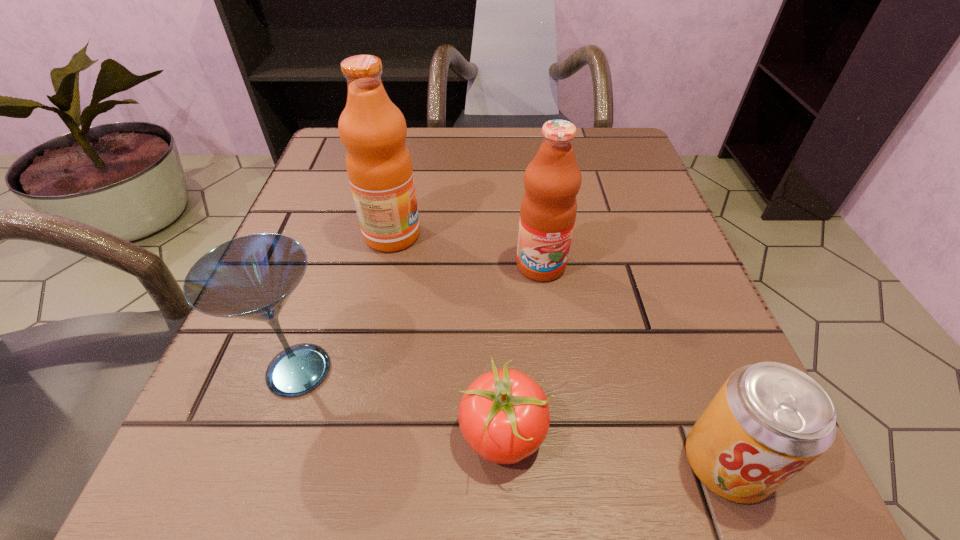
The height and width of the screenshot is (540, 960). What are the coordinates of `vacant area at the near edge` in the screenshot? It's located at (413, 489).

In the image, there is a desktop. At what (x,y) coordinates should I click in order to perform the action: click on vacant space at the left edge. Please return your answer as a coordinate pair (x, y). Looking at the image, I should click on (336, 249).

I want to click on free space at the right edge, so click(x=645, y=268).

Identify the location of vacant space at the far left corner. (336, 167).

I want to click on free space at the near left corner of the desktop, so click(x=316, y=438).

Find the location of `free space at the far right corner`. free space at the far right corner is located at coordinates (647, 188).

Where is `vacant area that lies between the shortest object and the fourth tallest object`? This screenshot has height=540, width=960. vacant area that lies between the shortest object and the fourth tallest object is located at coordinates (614, 448).

Where is `free space between the tallest object and the third shortest object`? The width and height of the screenshot is (960, 540). free space between the tallest object and the third shortest object is located at coordinates (346, 303).

Locate an element on the screen. free space that is in between the taller fruit juice and the fourth tallest object is located at coordinates (559, 349).

Locate an element on the screen. The image size is (960, 540). free space that is in between the left fruit juice and the shorter fruit juice is located at coordinates (467, 250).